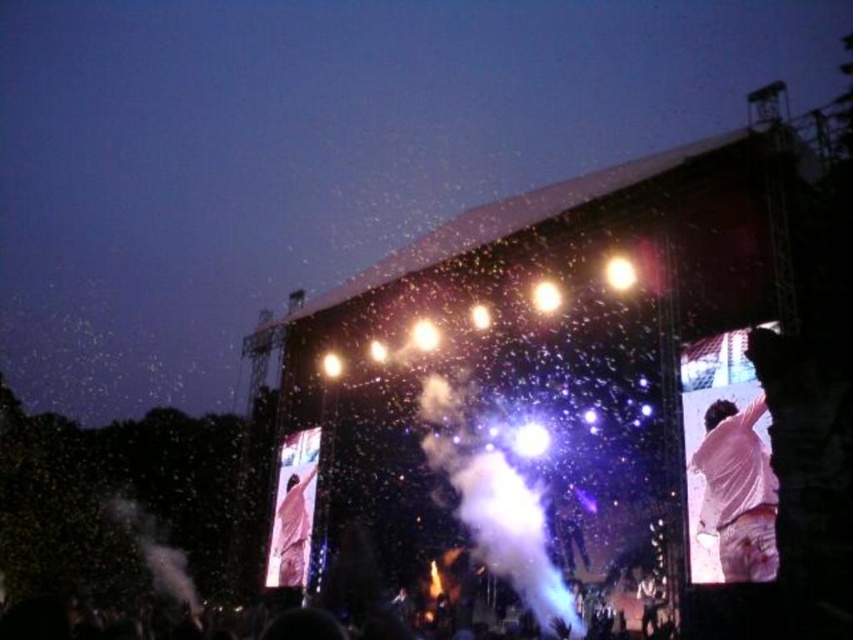
Can you confirm if white matte shirt at upper right is smaller than black matte crowd at lower center?

Correct, white matte shirt at upper right occupies less space than black matte crowd at lower center.

What do you see at coordinates (737, 492) in the screenshot? I see `white matte shirt at upper right` at bounding box center [737, 492].

The width and height of the screenshot is (853, 640). Find the location of `white matte shirt at upper right`. white matte shirt at upper right is located at coordinates (737, 492).

Can you confirm if black matte crowd at lower center is shorter than white matte shirt at center?

Incorrect, black matte crowd at lower center's height does not fall short of white matte shirt at center's.

How much distance is there between black matte crowd at lower center and white matte shirt at center?

black matte crowd at lower center and white matte shirt at center are 14.03 meters apart from each other.

Between point (73, 627) and point (294, 513), which one is positioned in front?

Point (73, 627)

The width and height of the screenshot is (853, 640). In order to click on black matte crowd at lower center in this screenshot , I will do `click(61, 621)`.

Between white matte shirt at upper right and white matte shirt at center, which one has less height?

white matte shirt at upper right is shorter.

Does point (757, 570) come closer to viewer compared to point (306, 545)?

That is True.

Locate an element on the screen. white matte shirt at upper right is located at coordinates (737, 492).